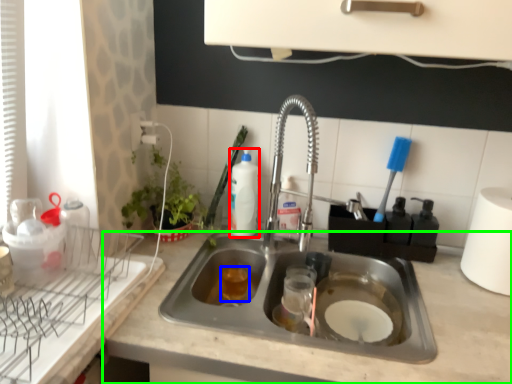
Question: Which object is the closest to the beverage (highlighted by a red box)? Choose among these: beverage (highlighted by a blue box) or countertop (highlighted by a green box).

Choices:
 (A) beverage
 (B) countertop

Answer: (A)